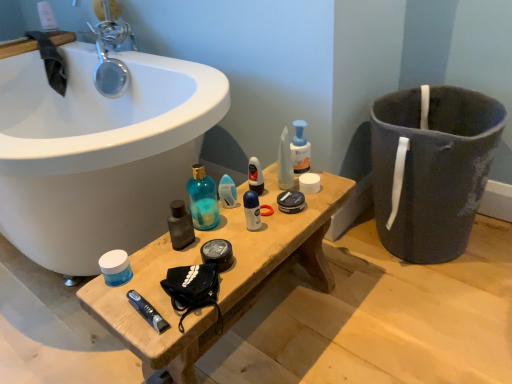
Locate an element on the screen. The width and height of the screenshot is (512, 384). spots to the right of wooden bench at center is located at coordinates (392, 321).